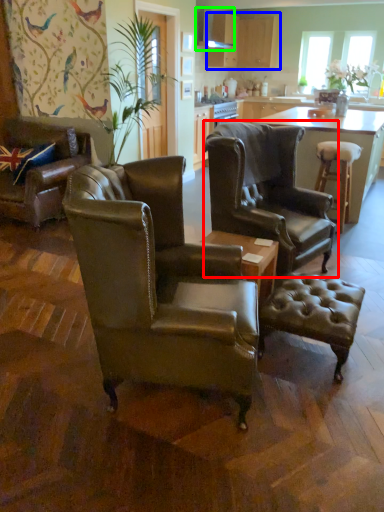
Question: Considering the real-world distances, which object is farthest from chair (highlighted by a red box)? cabinetry (highlighted by a blue box) or exhaust hood (highlighted by a green box)?

Choices:
 (A) cabinetry
 (B) exhaust hood

Answer: (A)